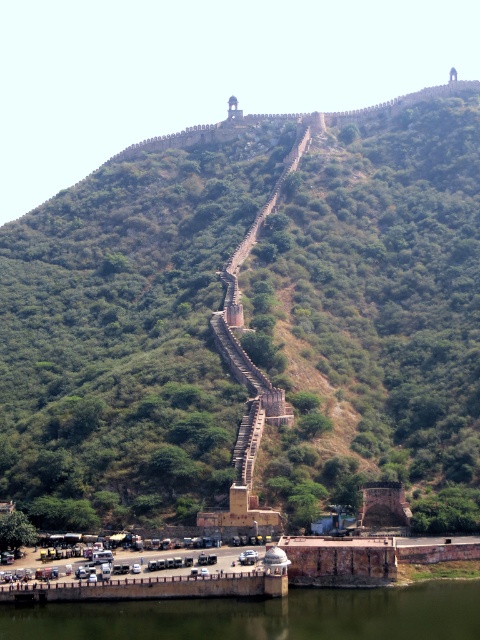
What do you see at coordinates (252, 320) in the screenshot? Image resolution: width=480 pixels, height=640 pixels. I see `green stone staircase at upper center` at bounding box center [252, 320].

Can you confirm if green stone staircase at upper center is positioned to the left of green concrete river at lower center?

Yes, green stone staircase at upper center is to the left of green concrete river at lower center.

Which is behind, point (182, 193) or point (111, 605)?

The point (182, 193) is behind.

Locate an element on the screen. The height and width of the screenshot is (640, 480). green stone staircase at upper center is located at coordinates (252, 320).